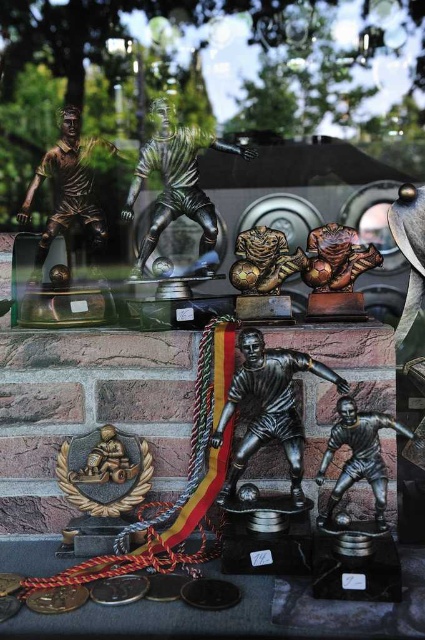
How much distance is there between bronze statue of soccer player at center and bronze/bronze-colored figure at center?

bronze statue of soccer player at center is 36.01 centimeters away from bronze/bronze-colored figure at center.

Is the position of bronze statue of soccer player at center more distant than that of bronze/bronze-colored figure at center?

That is False.

I want to click on bronze statue of soccer player at center, so click(x=269, y=406).

The height and width of the screenshot is (640, 425). In order to click on bronze statue of soccer player at center in this screenshot , I will do `click(269, 406)`.

Which of these two, bronze statue of soccer player at center or bronze figure at upper left, stands taller?

bronze figure at upper left

Is bronze statue of soccer player at center shorter than bronze figure at upper left?

Indeed, bronze statue of soccer player at center has a lesser height compared to bronze figure at upper left.

Is point (232, 492) more distant than point (44, 232)?

No, it is in front of (44, 232).

Find the location of a particular element. The width and height of the screenshot is (425, 640). bronze statue of soccer player at center is located at coordinates (269, 406).

Which of these two, bronze/bronze-colored figure at center or bronze figure at upper left, stands taller?

bronze/bronze-colored figure at center

Identify the location of bronze/bronze-colored figure at center. (175, 180).

Measure the distance between point (127, 204) and camera.

Point (127, 204) and camera are 1.31 meters apart from each other.

Locate an element on the screen. bronze/bronze-colored figure at center is located at coordinates (175, 180).